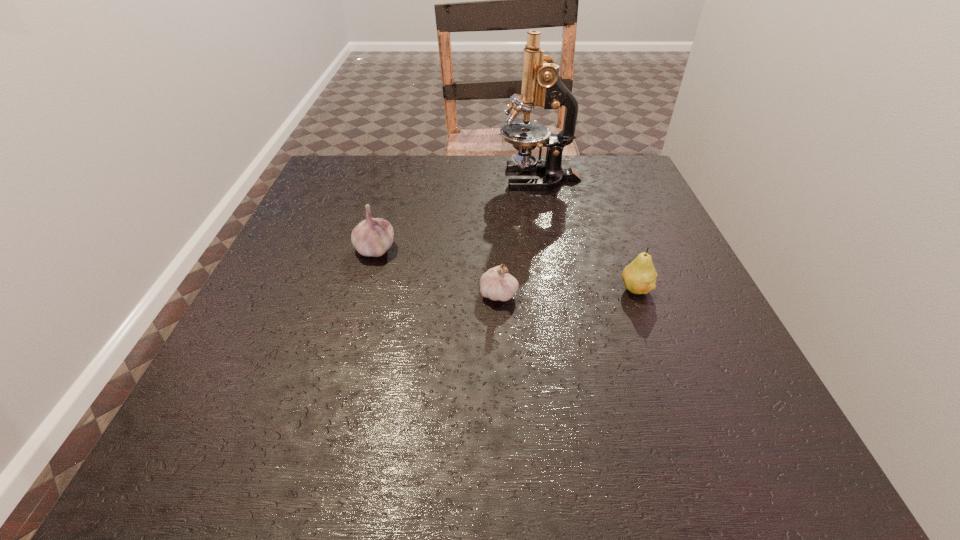
Image resolution: width=960 pixels, height=540 pixels. In order to click on vacant area located on the right of the farther garlic in this screenshot , I will do `click(465, 248)`.

I want to click on vacant point located on the front of the pear, so click(649, 326).

Locate an element on the screen. free spot located 0.100m on the front of the shorter garlic is located at coordinates (501, 352).

Where is `object that is at the far edge`? The width and height of the screenshot is (960, 540). object that is at the far edge is located at coordinates (541, 86).

The height and width of the screenshot is (540, 960). Find the location of `object that is at the left edge`. object that is at the left edge is located at coordinates (373, 237).

You are a GUI agent. You are given a task and a screenshot of the screen. Output one action in this format:
    pyautogui.click(x=<x>, y=<y>)
    Task: Click on the microscope that is at the right edge
    
    Given the screenshot: What is the action you would take?
    pyautogui.click(x=541, y=86)

Image resolution: width=960 pixels, height=540 pixels. What are the coordinates of `pear at the right edge` in the screenshot? It's located at (639, 277).

This screenshot has width=960, height=540. In order to click on object at the far right corner in this screenshot , I will do `click(541, 86)`.

Identify the location of free space at the far edge of the desktop. Image resolution: width=960 pixels, height=540 pixels. (508, 187).

The width and height of the screenshot is (960, 540). In order to click on free space at the left edge of the desktop in this screenshot , I will do `click(279, 317)`.